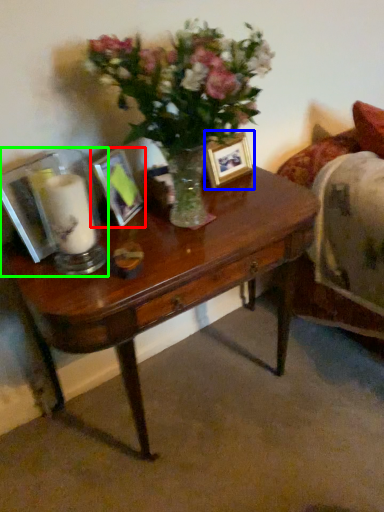
Question: Which is farther away from picture frame (highlighted by a red box)? picture frame (highlighted by a blue box) or tableware (highlighted by a green box)?

Choices:
 (A) picture frame
 (B) tableware

Answer: (A)